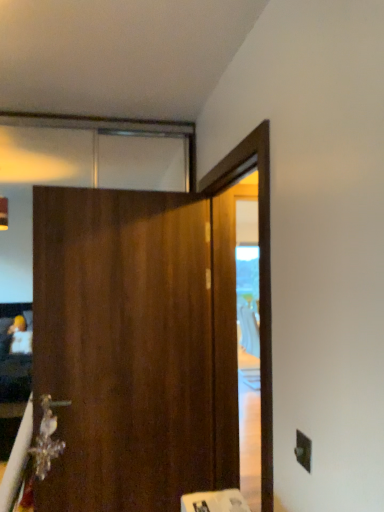
Question: Does metallic crystal at lower left have a greater width compared to wooden barn door at center?

Choices:
 (A) yes
 (B) no

Answer: (B)

Question: Is metallic crystal at lower left further to the viewer compared to wooden barn door at center?

Choices:
 (A) no
 (B) yes

Answer: (B)

Question: Does metallic crystal at lower left have a greater height compared to wooden barn door at center?

Choices:
 (A) yes
 (B) no

Answer: (B)

Question: From the image's perspective, is metallic crystal at lower left below wooden barn door at center?

Choices:
 (A) no
 (B) yes

Answer: (B)

Question: Could wooden barn door at center be considered to be inside metallic crystal at lower left?

Choices:
 (A) yes
 (B) no

Answer: (B)

Question: Considering the relative sizes of metallic crystal at lower left and wooden barn door at center in the image provided, is metallic crystal at lower left shorter than wooden barn door at center?

Choices:
 (A) no
 (B) yes

Answer: (B)

Question: Could you tell me if metallic crystal at lower left is turned towards black plastic electric outlet at lower right?

Choices:
 (A) no
 (B) yes

Answer: (A)

Question: From the image's perspective, would you say metallic crystal at lower left is shown under black plastic electric outlet at lower right?

Choices:
 (A) no
 (B) yes

Answer: (B)

Question: Can you confirm if metallic crystal at lower left is bigger than black plastic electric outlet at lower right?

Choices:
 (A) yes
 (B) no

Answer: (A)

Question: Does metallic crystal at lower left have a lesser width compared to black plastic electric outlet at lower right?

Choices:
 (A) yes
 (B) no

Answer: (B)

Question: Is metallic crystal at lower left positioned with its back to black plastic electric outlet at lower right?

Choices:
 (A) no
 (B) yes

Answer: (A)

Question: Is metallic crystal at lower left not within black plastic electric outlet at lower right?

Choices:
 (A) yes
 (B) no

Answer: (A)

Question: Is black plastic electric outlet at lower right positioned with its back to metallic crystal at lower left?

Choices:
 (A) yes
 (B) no

Answer: (B)